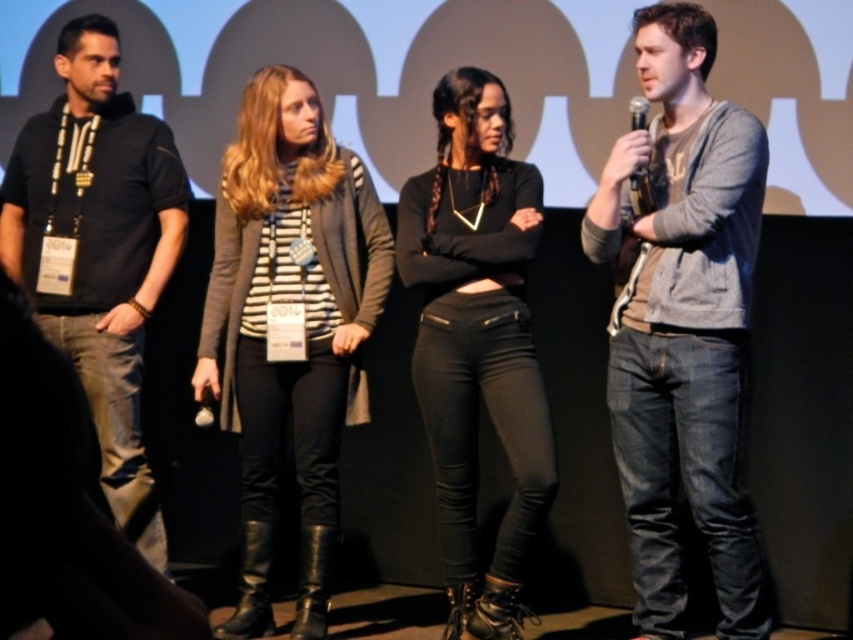
Who is more forward, [325,348] or [427,173]?

Point [325,348] is in front.

How far apart are striped knit sweater at center and black leather pants at center?

striped knit sweater at center is 19.97 inches away from black leather pants at center.

The width and height of the screenshot is (853, 640). Describe the element at coordinates (299, 317) in the screenshot. I see `striped knit sweater at center` at that location.

I want to click on striped knit sweater at center, so click(299, 317).

Is point (610, 394) farther from camera compared to point (175, 218)?

No, (610, 394) is in front of (175, 218).

Who is taller, gray cotton sweater at right or black cotton polo shirt at left?

Standing taller between the two is gray cotton sweater at right.

Between point (759, 579) and point (119, 340), which one is positioned behind?

The point (119, 340) is behind.

You are a GUI agent. You are given a task and a screenshot of the screen. Output one action in this format:
    pyautogui.click(x=<x>, y=<y>)
    Task: Click on the gray cotton sweater at right
    The height and width of the screenshot is (640, 853).
    Given the screenshot: What is the action you would take?
    pyautogui.click(x=683, y=326)

Does black cotton polo shirt at left have a larger size compared to black plastic microphone at right?

Correct, black cotton polo shirt at left is larger in size than black plastic microphone at right.

Does black cotton polo shirt at left lie in front of black plastic microphone at right?

No, it is behind black plastic microphone at right.

Is point (74, 236) behind point (647, 180)?

Yes, it is behind point (647, 180).

Identify the location of black cotton polo shirt at left. The image size is (853, 640). (97, 248).